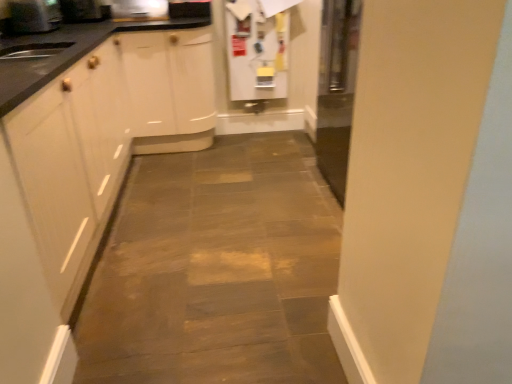
Question: Is white matte refrigerator at upper center, the 1th appliance viewed from the right, oriented away from metallic stainless steel microwave at upper left, marked as the second appliance in a left-to-right arrangement?

Choices:
 (A) yes
 (B) no

Answer: (B)

Question: From the image's perspective, is white matte refrigerator at upper center, the 1th appliance viewed from the right, under metallic stainless steel microwave at upper left, acting as the 3th appliance starting from the right?

Choices:
 (A) yes
 (B) no

Answer: (A)

Question: Is white matte refrigerator at upper center, marked as the 4th appliance in a left-to-right arrangement, to the right of metallic stainless steel microwave at upper left, marked as the second appliance in a left-to-right arrangement, from the viewer's perspective?

Choices:
 (A) no
 (B) yes

Answer: (B)

Question: From a real-world perspective, is white matte refrigerator at upper center, marked as the 4th appliance in a left-to-right arrangement, positioned over metallic stainless steel microwave at upper left, acting as the 3th appliance starting from the right, based on gravity?

Choices:
 (A) no
 (B) yes

Answer: (A)

Question: Does white matte refrigerator at upper center, marked as the 4th appliance in a left-to-right arrangement, turn towards metallic stainless steel microwave at upper left, acting as the 3th appliance starting from the right?

Choices:
 (A) no
 (B) yes

Answer: (A)

Question: From a real-world perspective, is white matte refrigerator at upper center, marked as the 4th appliance in a left-to-right arrangement, physically below metallic stainless steel microwave at upper left, acting as the 3th appliance starting from the right?

Choices:
 (A) no
 (B) yes

Answer: (B)

Question: From a real-world perspective, is metallic stainless steel microwave at upper left, acting as the 3th appliance starting from the right, over metallic stainless steel microwave at upper center, the 2th appliance positioned from the right?

Choices:
 (A) yes
 (B) no

Answer: (A)

Question: Can you confirm if metallic stainless steel microwave at upper left, marked as the second appliance in a left-to-right arrangement, is bigger than metallic stainless steel microwave at upper center, which appears as the 3th appliance when viewed from the left?

Choices:
 (A) no
 (B) yes

Answer: (B)

Question: Is metallic stainless steel microwave at upper left, marked as the second appliance in a left-to-right arrangement, oriented away from metallic stainless steel microwave at upper center, the 2th appliance positioned from the right?

Choices:
 (A) no
 (B) yes

Answer: (A)

Question: Considering the relative sizes of metallic stainless steel microwave at upper left, marked as the second appliance in a left-to-right arrangement, and metallic stainless steel microwave at upper center, which appears as the 3th appliance when viewed from the left, in the image provided, is metallic stainless steel microwave at upper left, marked as the second appliance in a left-to-right arrangement, wider than metallic stainless steel microwave at upper center, which appears as the 3th appliance when viewed from the left,?

Choices:
 (A) yes
 (B) no

Answer: (A)

Question: Is metallic stainless steel microwave at upper left, acting as the 3th appliance starting from the right, thinner than metallic stainless steel microwave at upper center, which appears as the 3th appliance when viewed from the left?

Choices:
 (A) yes
 (B) no

Answer: (B)

Question: Considering the relative sizes of metallic stainless steel microwave at upper left, acting as the 3th appliance starting from the right, and metallic stainless steel microwave at upper center, the 2th appliance positioned from the right, in the image provided, is metallic stainless steel microwave at upper left, acting as the 3th appliance starting from the right, shorter than metallic stainless steel microwave at upper center, the 2th appliance positioned from the right,?

Choices:
 (A) no
 (B) yes

Answer: (B)

Question: Is metallic silver toaster at upper left, acting as the fourth appliance starting from the right, further to the viewer compared to metallic stainless steel microwave at upper left, acting as the 3th appliance starting from the right?

Choices:
 (A) no
 (B) yes

Answer: (A)